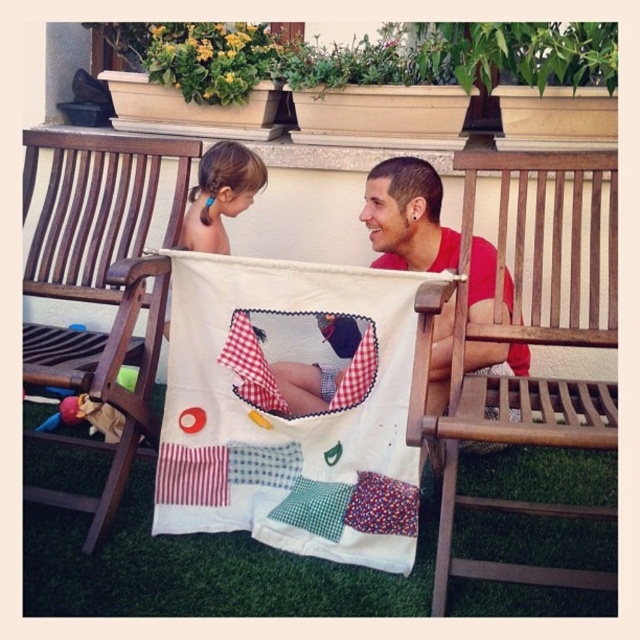
You are standing in the garden and see two points marked in the image. Which point is closer to you, point (339, 532) or point (237, 209)?

Point (339, 532) is closer to the viewer than point (237, 209).

Consider the image. You are standing at the origin point in the garden scene. Where is the wooden park bench at left located?

The wooden park bench at left is located at point 0.441 on the x axis and 0.156 on the y axis.